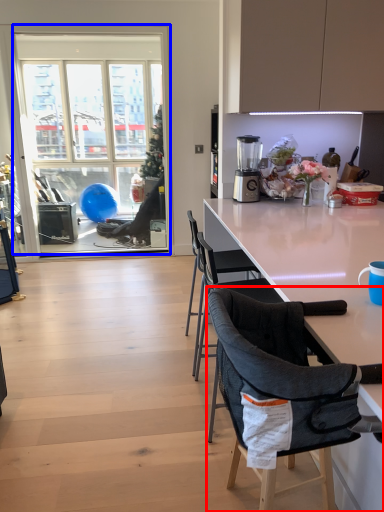
Question: Which point is closer to the camera, chair (highlighted by a red box) or window (highlighted by a blue box)?

Choices:
 (A) chair
 (B) window

Answer: (A)